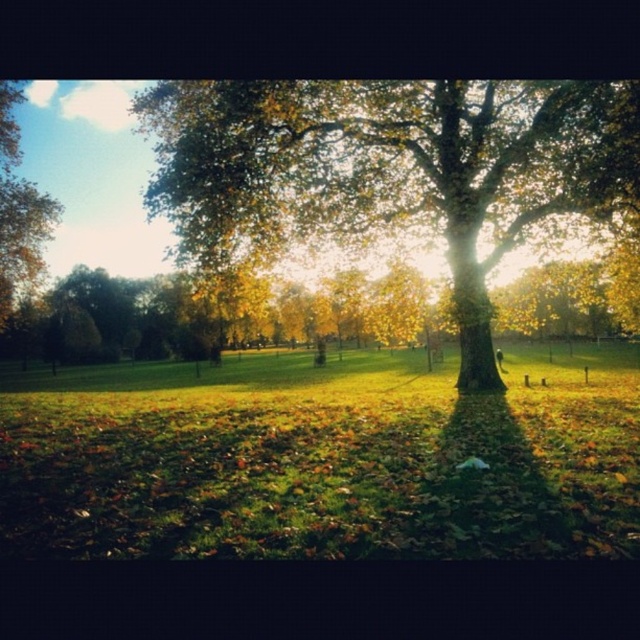
You are standing at the point with coordinates point (212, 179) and want to walk to the point with coordinates point (44, 243). Which direction should you move relative to the park scene?

You should move backward because point (212, 179) is in front of point (44, 243), so to reach the latter, you need to move in the opposite direction.

You are standing in the park and want to take a photo of the green grass at center and the green leafy tree at upper left. Which object is closer to the camera based on their positions?

The green grass at center is closer to the camera because it is located below the green leafy tree at upper left, meaning the tree is further away in the scene.

You are a photographer wanting to capture both the golden textured tree at center and the green leafy tree at upper left in a single frame. Based on their positions, which tree should you focus on first to ensure both are in the shot?

The golden textured tree at center is positioned on the right side of green leafy tree at upper left, so you should focus on the green leafy tree at upper left first to ensure both are in the shot.